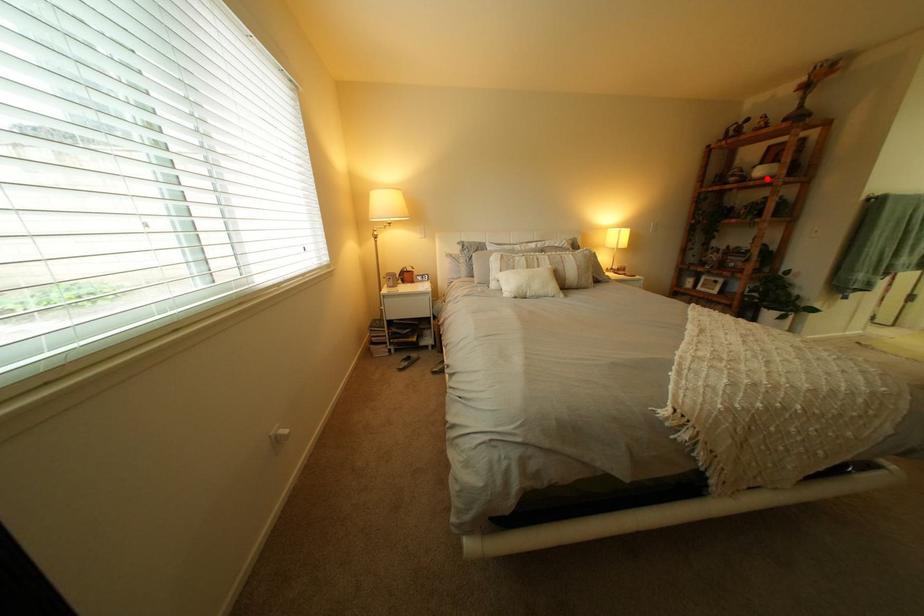
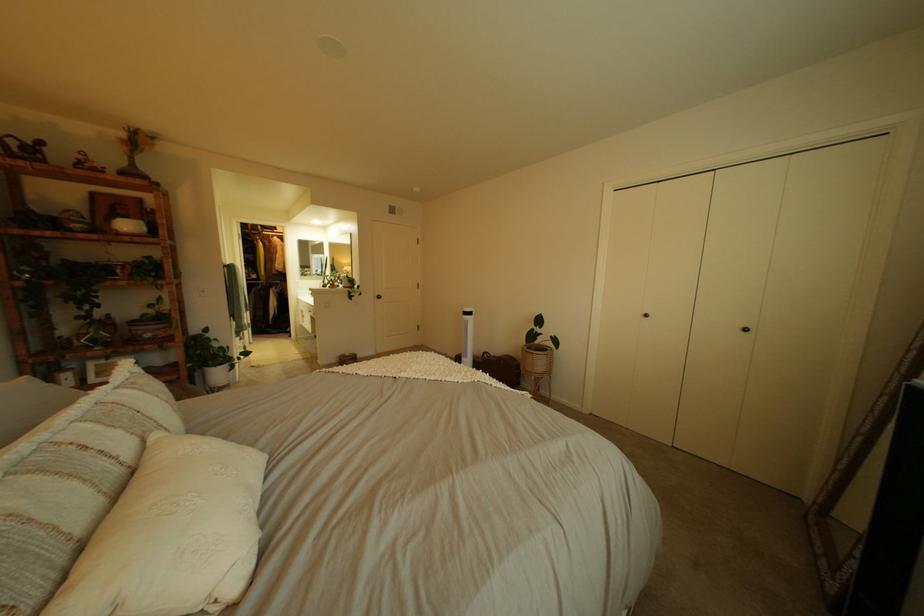
Locate, in the second image, the point that corresponds to the highlighted location in the first image.

(132, 232)